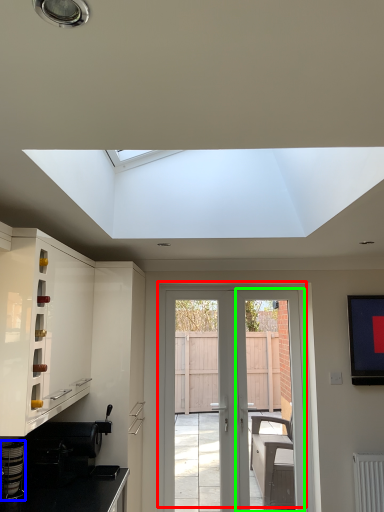
Question: Which object is positioned farthest from door (highlighted by a red box)? Select from appliance (highlighted by a blue box) and screen door (highlighted by a green box).

Choices:
 (A) appliance
 (B) screen door

Answer: (A)